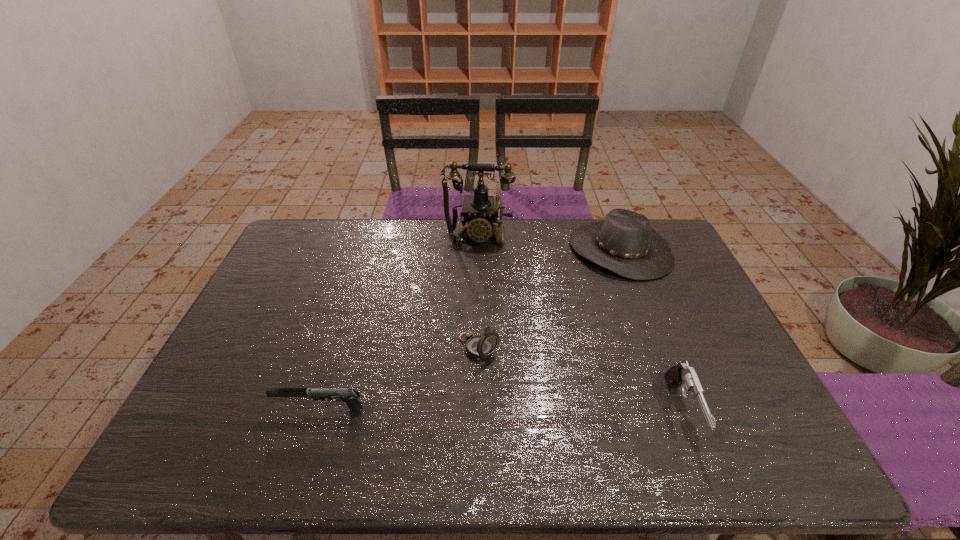
You are a GUI agent. You are given a task and a screenshot of the screen. Output one action in this format:
    pyautogui.click(x=<x>, y=<y>)
    Task: Click on the shorter gun
    Image resolution: width=960 pixels, height=540 pixels.
    Given the screenshot: What is the action you would take?
    pyautogui.click(x=349, y=396)

Locate an element on the screen. the shortest object is located at coordinates (349, 396).

You are a GUI agent. You are given a task and a screenshot of the screen. Output one action in this format:
    pyautogui.click(x=<x>, y=<y>)
    Task: Click on the right gun
    This screenshot has width=960, height=540.
    Given the screenshot: What is the action you would take?
    pyautogui.click(x=683, y=375)

The height and width of the screenshot is (540, 960). What are the coordinates of `telephone` in the screenshot? It's located at (480, 211).

This screenshot has width=960, height=540. Find the location of `compass`. compass is located at coordinates (479, 347).

Find the location of a particular element. The width and height of the screenshot is (960, 540). hat is located at coordinates (624, 243).

Where is `vacant space located at the muzzle end of the left gun`? vacant space located at the muzzle end of the left gun is located at coordinates click(235, 410).

Where is `vacant space located 0.140m at the muzzle end of the left gun`? The width and height of the screenshot is (960, 540). vacant space located 0.140m at the muzzle end of the left gun is located at coordinates (218, 410).

You are a GUI agent. You are given a task and a screenshot of the screen. Output one action in this format:
    pyautogui.click(x=<x>, y=<y>)
    Task: Click on the free space located 0.330m on the rotary dial of the tallest object
    This screenshot has height=540, width=960.
    Given the screenshot: What is the action you would take?
    pyautogui.click(x=468, y=320)

Find the location of a particular element. This screenshot has width=960, height=540. vacant space located on the rotary dial of the tallest object is located at coordinates click(468, 315).